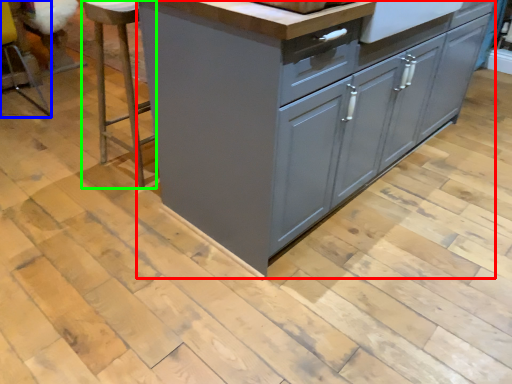
Question: Considering the real-world distances, which object is closest to chest of drawers (highlighted by a red box)? bar stool (highlighted by a blue box) or bar stool (highlighted by a green box).

Choices:
 (A) bar stool
 (B) bar stool

Answer: (B)